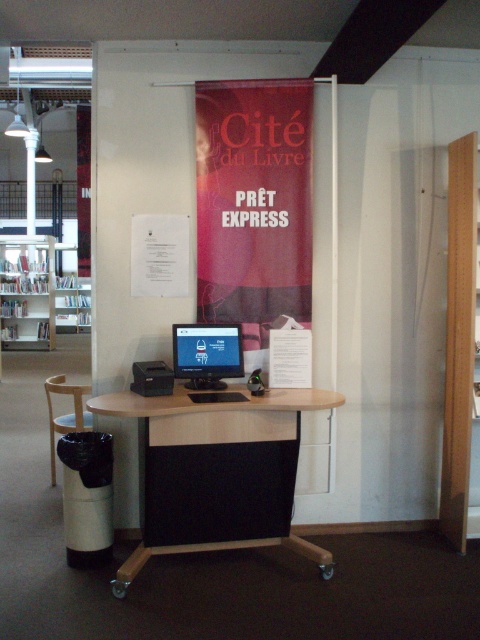
Looking at this image, you are a librarian who needs to move a 2.5 meter long ladder from the metallic silver bookshelf at left to the wooden chair at lower left. Is there enough space to move it without tilting it?

The distance between the metallic silver bookshelf at left and the wooden chair at lower left is 7.14 meters, so yes, there is enough space to move the 2.5 meter long ladder without tilting it.

What is the spatial relationship between the matte red banner at center and the wooden desk at center?

The matte red banner at center is located to the right of the wooden desk at center.